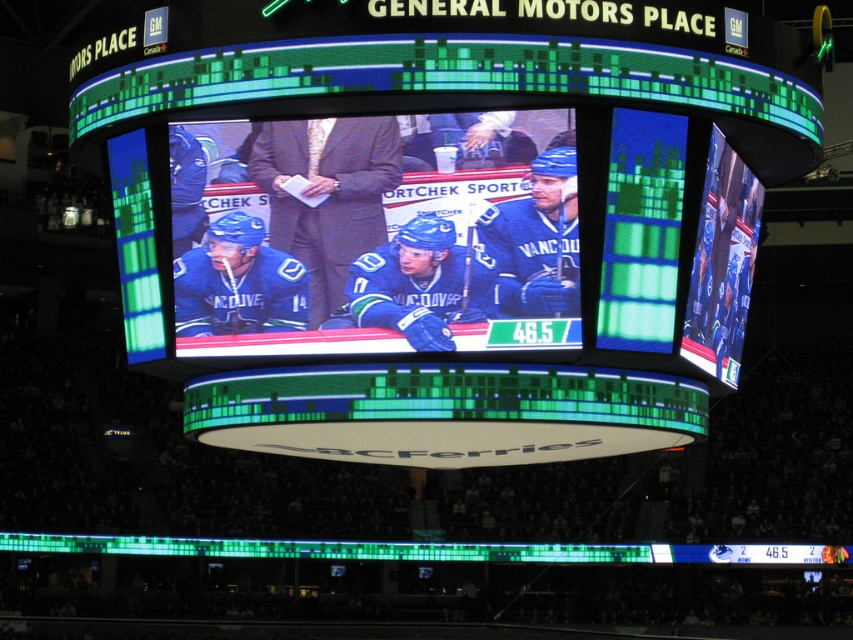
Who is positioned more to the left, matte black scoreboard at center or blue jersey hockey players at center?

From the viewer's perspective, blue jersey hockey players at center appears more on the left side.

Does matte black scoreboard at center have a greater height compared to blue jersey hockey players at center?

Yes.

Measure the distance between point (473, 259) and camera.

Point (473, 259) is 46.37 meters from camera.

The image size is (853, 640). Find the location of `matte black scoreboard at center`. matte black scoreboard at center is located at coordinates (444, 230).